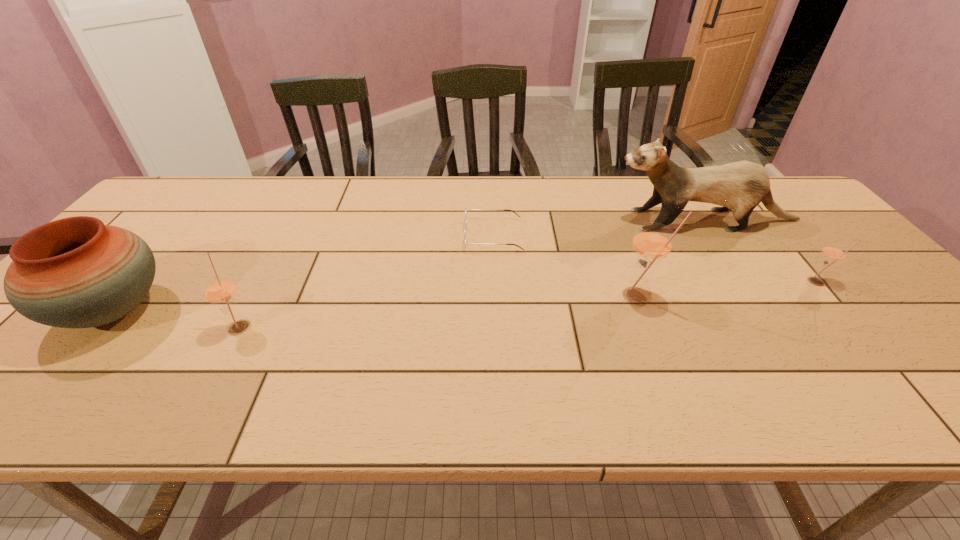
Point out which object is positioned as the fourth nearest to the ferret. Please provide its 2D coordinates. Your answer should be formatted as a tuple, i.e. [(x, y)], where the tuple contains the x and y coordinates of a point satisfying the conditions above.

[(220, 291)]

Where is `object that is the fifth closest to the leftmost object`? The image size is (960, 540). object that is the fifth closest to the leftmost object is located at coordinates (833, 253).

This screenshot has width=960, height=540. I want to click on straw that is the closest to the ferret, so click(x=833, y=253).

Locate an element on the screen. straw that is the second closest one to the ferret is located at coordinates (652, 242).

Image resolution: width=960 pixels, height=540 pixels. Find the location of `free spot that satisfies the following two spatial constraints: 1. on the front-facing side of the spectacles; 2. on the right side of the rightmost straw`. free spot that satisfies the following two spatial constraints: 1. on the front-facing side of the spectacles; 2. on the right side of the rightmost straw is located at coordinates (495, 282).

Identify the location of vacant position in the image that satisfies the following two spatial constraints: 1. on the front-facing side of the spectacles; 2. on the back side of the second straw from right to left. The image size is (960, 540). (495, 295).

This screenshot has width=960, height=540. Identify the location of free location that satisfies the following two spatial constraints: 1. on the back side of the second straw from right to left; 2. on the front-facing side of the spectacles. (614, 235).

Find the location of a particular element. vacant point that satisfies the following two spatial constraints: 1. on the face of the ferret; 2. on the right side of the second shortest object is located at coordinates (745, 282).

This screenshot has height=540, width=960. I want to click on free location that satisfies the following two spatial constraints: 1. on the back side of the second straw from right to left; 2. on the front-facing side of the third object from left to right, so click(x=614, y=235).